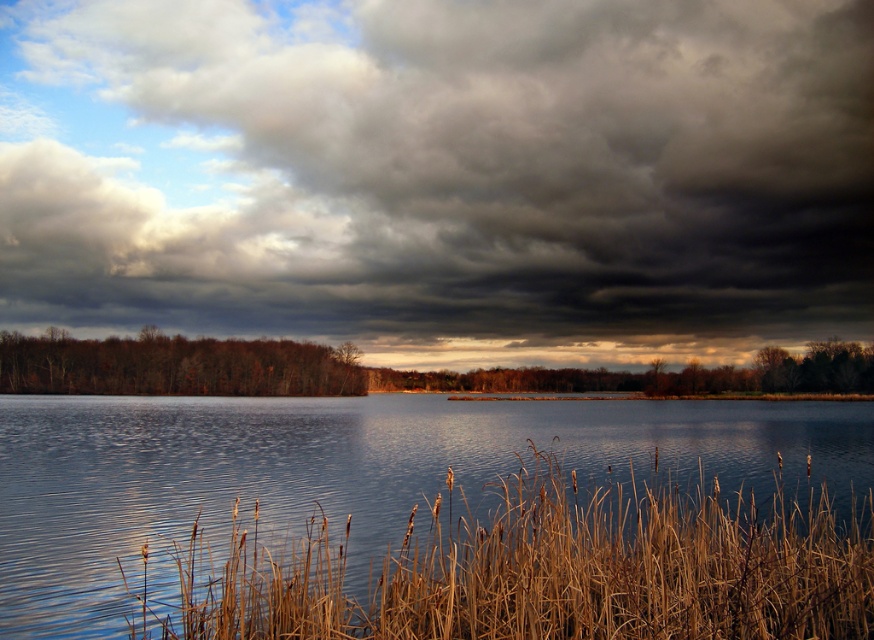
Question: Is dark gray cloud at upper center to the right of dry grass at lower center from the viewer's perspective?

Choices:
 (A) no
 (B) yes

Answer: (A)

Question: Can you confirm if dark gray cloud at upper center is positioned below dry grass at lower center?

Choices:
 (A) no
 (B) yes

Answer: (A)

Question: Which of the following is the farthest from the observer?

Choices:
 (A) (538, 477)
 (B) (677, 352)

Answer: (B)

Question: Which of the following is the farthest from the observer?

Choices:
 (A) (425, 268)
 (B) (614, 497)

Answer: (A)

Question: Can you confirm if dark gray cloud at upper center is thinner than dry grass at lower center?

Choices:
 (A) yes
 (B) no

Answer: (B)